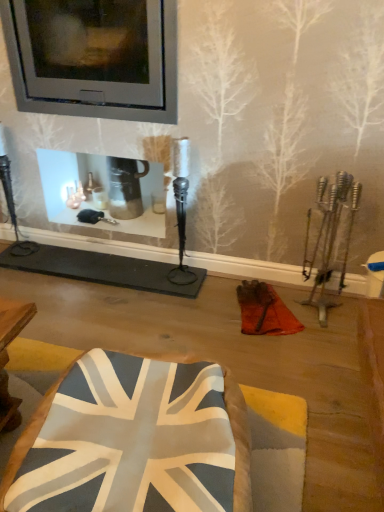
Question: Does point (104, 10) appear closer or farther from the camera than point (231, 390)?

Choices:
 (A) farther
 (B) closer

Answer: (A)

Question: In terms of height, does metallic glass fireplace at upper center look taller or shorter compared to fabric union jack cushion at center?

Choices:
 (A) tall
 (B) short

Answer: (A)

Question: Considering the relative positions of metallic glass fireplace at upper center and fabric union jack cushion at center in the image provided, is metallic glass fireplace at upper center to the left or to the right of fabric union jack cushion at center?

Choices:
 (A) left
 (B) right

Answer: (A)

Question: Which is correct: fabric union jack cushion at center is inside metallic glass fireplace at upper center, or outside of it?

Choices:
 (A) outside
 (B) inside

Answer: (A)

Question: Is fabric union jack cushion at center taller or shorter than metallic glass fireplace at upper center?

Choices:
 (A) tall
 (B) short

Answer: (B)

Question: From the image's perspective, is fabric union jack cushion at center located above or below metallic glass fireplace at upper center?

Choices:
 (A) below
 (B) above

Answer: (A)

Question: Based on their sizes in the image, would you say fabric union jack cushion at center is bigger or smaller than metallic glass fireplace at upper center?

Choices:
 (A) big
 (B) small

Answer: (B)